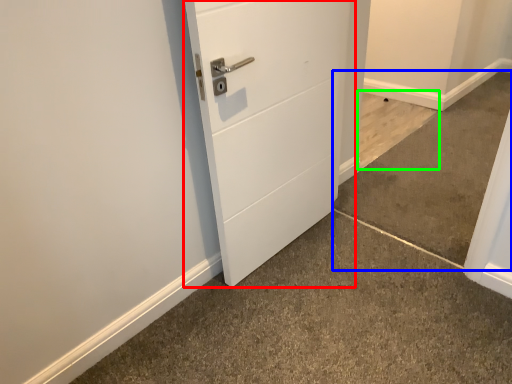
Question: Which object is positioned closest to door (highlighted by a red box)? Select from concrete (highlighted by a blue box) and concrete (highlighted by a green box).

Choices:
 (A) concrete
 (B) concrete

Answer: (A)